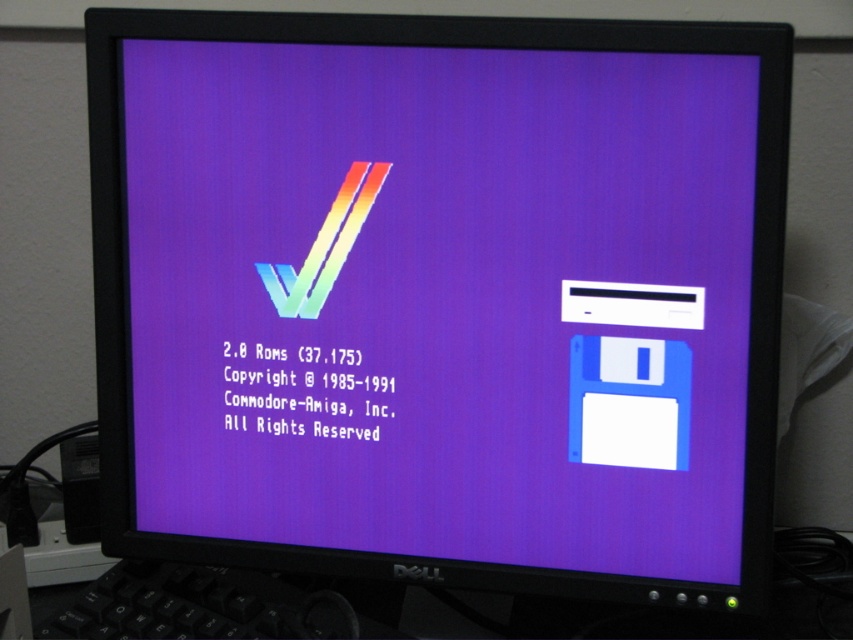
Which of these two, matte plastic floppy disk at right or black matte keyboard at lower left, stands shorter?

Standing shorter between the two is black matte keyboard at lower left.

Between point (724, 280) and point (254, 579), which one is positioned in front?

Positioned in front is point (724, 280).

Between point (201, 352) and point (171, 636), which one is positioned in front?

Point (171, 636)

Where is `matte plastic floppy disk at right`? matte plastic floppy disk at right is located at coordinates (442, 301).